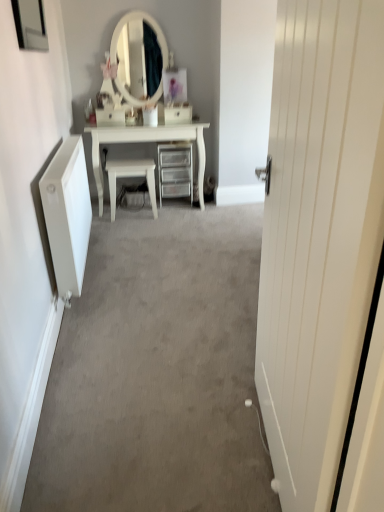
Image resolution: width=384 pixels, height=512 pixels. Describe the element at coordinates (319, 234) in the screenshot. I see `white wooden door at right` at that location.

Consider the image. Measure the distance between point [265,392] and camera.

The distance of point [265,392] from camera is 1.53 meters.

What do you see at coordinates (175, 170) in the screenshot?
I see `clear plastic drawers at center` at bounding box center [175, 170].

Locate an element on the screen. white wooden door at right is located at coordinates (319, 234).

Is metallic mirror at upper left not inside white plastic drawer at center, acting as the second drawer starting from the left?

Yes, metallic mirror at upper left is not within white plastic drawer at center, acting as the second drawer starting from the left.

Is metallic mirror at upper left taller than white plastic drawer at center, which appears as the 1th drawer when viewed from the right?

Yes, metallic mirror at upper left is taller than white plastic drawer at center, which appears as the 1th drawer when viewed from the right.

Locate an element on the screen. Image resolution: width=384 pixels, height=512 pixels. picture frame that is on the left side of white plastic drawer at center, which appears as the 1th drawer when viewed from the right is located at coordinates (30, 24).

Would you consider metallic mirror at upper left to be distant from white plastic drawer at center, acting as the second drawer starting from the left?

Absolutely, metallic mirror at upper left is distant from white plastic drawer at center, acting as the second drawer starting from the left.

Considering the relative sizes of white wooden door at right and white glossy drawer at center, the first drawer from the left, in the image provided, is white wooden door at right wider than white glossy drawer at center, the first drawer from the left,?

Incorrect, the width of white wooden door at right does not surpass that of white glossy drawer at center, the first drawer from the left.

Could you tell me if white wooden door at right is turned towards white glossy drawer at center, marked as the second drawer in a right-to-left arrangement?

No, white wooden door at right is not turned towards white glossy drawer at center, marked as the second drawer in a right-to-left arrangement.

Considering the sizes of white wooden door at right and white glossy drawer at center, the first drawer from the left, in the image, is white wooden door at right taller or shorter than white glossy drawer at center, the first drawer from the left,?

Clearly, white wooden door at right is taller compared to white glossy drawer at center, the first drawer from the left.

Is white wooden door at right a part of metallic mirror at upper left?

No, metallic mirror at upper left does not contain white wooden door at right.

Are metallic mirror at upper left and white wooden door at right far apart?

Indeed, metallic mirror at upper left is not near white wooden door at right.

This screenshot has height=512, width=384. I want to click on door lying in front of the metallic mirror at upper left, so click(319, 234).

From the image's perspective, is metallic mirror at upper left located above or below white wooden door at right?

Clearly, from the image's perspective, metallic mirror at upper left is above white wooden door at right.

From the picture: Does clear plastic drawers at center turn towards white wooden door at right?

Yes, clear plastic drawers at center is oriented towards white wooden door at right.

Between clear plastic drawers at center and white wooden door at right, which one has larger size?

Bigger between the two is white wooden door at right.

Does clear plastic drawers at center lie in front of white wooden door at right?

No, clear plastic drawers at center is further to the viewer.

Which is more to the left, white glossy chair at center or white wooden door at right?

From the viewer's perspective, white glossy chair at center appears more on the left side.

Can you confirm if white glossy chair at center is smaller than white wooden door at right?

Indeed, white glossy chair at center has a smaller size compared to white wooden door at right.

What's the angular difference between white glossy chair at center and white wooden door at right's facing directions?

They differ by 83.8 degrees in their facing directions.

Who is shorter, white glossy chair at center or white wooden door at right?

white glossy chair at center is shorter.

Is white glossy chair at center next to metallic mirror at upper left and touching it?

white glossy chair at center and metallic mirror at upper left are not in contact.

Which is behind, point (140, 162) or point (35, 30)?

The point (140, 162) is farther from the camera.

Between white glossy chair at center and metallic mirror at upper left, which one has less height?

Standing shorter between the two is metallic mirror at upper left.

In the scene shown: Is white glossy chair at center turned away from metallic mirror at upper left?

That's not correct — white glossy chair at center is not looking away from metallic mirror at upper left.

Is white plastic drawer at center, acting as the second drawer starting from the left, in contact with white glossy chair at center?

white plastic drawer at center, acting as the second drawer starting from the left, and white glossy chair at center are clearly separated.

Considering the positions of points (174, 108) and (136, 170), is point (174, 108) farther from camera compared to point (136, 170)?

Yes, it is.

Looking at this image, is white plastic drawer at center, acting as the second drawer starting from the left, thinner than white glossy chair at center?

Indeed, white plastic drawer at center, acting as the second drawer starting from the left, has a lesser width compared to white glossy chair at center.

Which is more to the right, white plastic drawer at center, which appears as the 1th drawer when viewed from the right, or white glossy chair at center?

Positioned to the right is white plastic drawer at center, which appears as the 1th drawer when viewed from the right.

The height and width of the screenshot is (512, 384). I want to click on picture frame above the white plastic drawer at center, which appears as the 1th drawer when viewed from the right (from a real-world perspective), so click(x=30, y=24).

This screenshot has width=384, height=512. In order to click on door that appears on the right of white glossy drawer at center, the first drawer from the left in this screenshot , I will do `click(319, 234)`.

From the image, which object appears to be nearer to white glossy chair at center, metallic mirror at upper left or white wooden door at right?

metallic mirror at upper left lies closer to white glossy chair at center than the other object.

From the image, which object appears to be nearer to white plastic drawer at center, acting as the second drawer starting from the left, white glossy chair at center or white wooden door at right?

The object closer to white plastic drawer at center, acting as the second drawer starting from the left, is white glossy chair at center.

When comparing their distances from white wooden door at right, does white plastic drawer at center, which appears as the 1th drawer when viewed from the right, or clear plastic drawers at center seem closer?

The object closer to white wooden door at right is clear plastic drawers at center.

Looking at the image, which one is located further to white plastic drawer at center, which appears as the 1th drawer when viewed from the right, white glossy drawer at center, the first drawer from the left, or white glossy chair at center?

white glossy chair at center lies further to white plastic drawer at center, which appears as the 1th drawer when viewed from the right, than the other object.

Looking at this image, estimate the real-world distances between objects in this image. Which object is closer to white plastic drawer at center, which appears as the 1th drawer when viewed from the right, metallic mirror at upper left or white glossy drawer at center, the first drawer from the left?

Based on the image, white glossy drawer at center, the first drawer from the left, appears to be nearer to white plastic drawer at center, which appears as the 1th drawer when viewed from the right.

Based on their spatial positions, is white wooden door at right or white glossy drawer at center, the first drawer from the left, further from clear plastic drawers at center?

white wooden door at right lies further to clear plastic drawers at center than the other object.

Based on their spatial positions, is white glossy drawer at center, marked as the second drawer in a right-to-left arrangement, or clear plastic drawers at center further from white plastic drawer at center, acting as the second drawer starting from the left?

Based on the image, white glossy drawer at center, marked as the second drawer in a right-to-left arrangement, appears to be further to white plastic drawer at center, acting as the second drawer starting from the left.

From the image, which object appears to be farther from white glossy drawer at center, the first drawer from the left, white glossy chair at center or metallic mirror at upper left?

metallic mirror at upper left is further to white glossy drawer at center, the first drawer from the left.

The width and height of the screenshot is (384, 512). In order to click on chair located between white wooden door at right and clear plastic drawers at center in the depth direction in this screenshot , I will do `click(131, 176)`.

Locate an element on the screen. chair between white wooden door at right and white glossy drawer at center, the first drawer from the left, along the z-axis is located at coordinates (131, 176).

Identify the location of the chest of drawers positioned between white wooden door at right and white plastic drawer at center, which appears as the 1th drawer when viewed from the right, from near to far. (175, 170).

Identify the location of chair between metallic mirror at upper left and white glossy drawer at center, the first drawer from the left, from front to back. Image resolution: width=384 pixels, height=512 pixels. (131, 176).